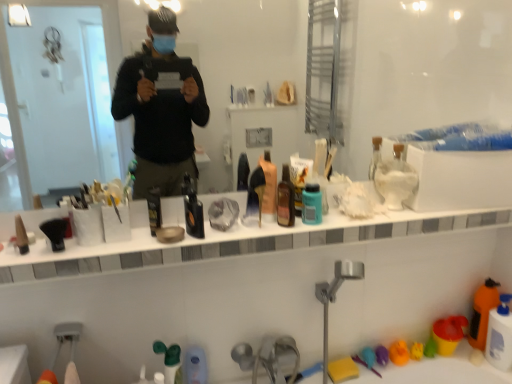
I want to click on vacant area to the right of black matte bottle at center, which is the 1th mouthwash from left to right, so click(225, 231).